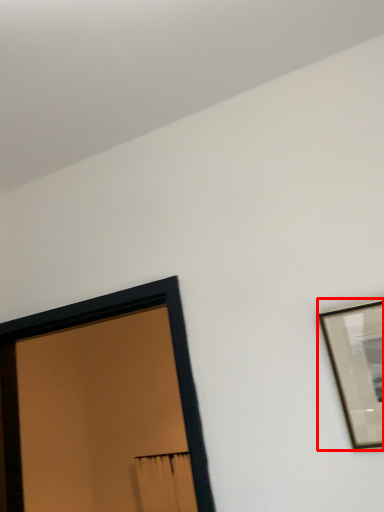
Question: From the image, what is the correct spatial relationship of picture frame (annotated by the red box) in relation to picture frame?

Choices:
 (A) right
 (B) left

Answer: (A)